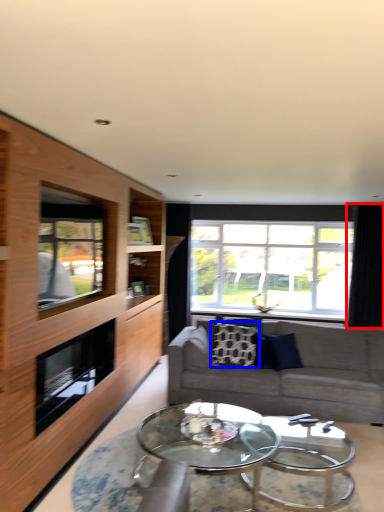
Question: Which object appears closest to the camera in this image, curtain (highlighted by a red box) or pillow (highlighted by a blue box)?

Choices:
 (A) curtain
 (B) pillow

Answer: (B)